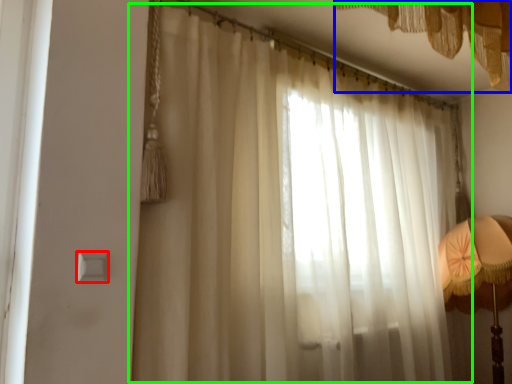
Question: Estimate the real-world distances between objects in this image. Which object is farther from light switch (highlighted by a red box), curtain (highlighted by a blue box) or curtain (highlighted by a green box)?

Choices:
 (A) curtain
 (B) curtain

Answer: (A)